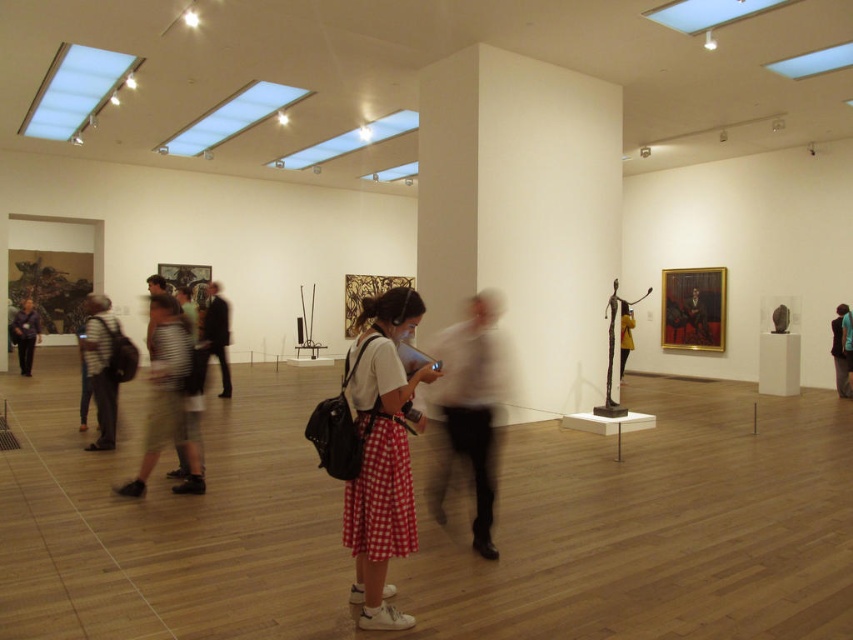
You are an art enthusiast standing in the gallery. You notice two items on the left side of the room, the striped shirt at left and the matte black backpack at left. Which item is positioned closer to you?

The striped shirt at left is closer to the viewer than the matte black backpack at left.

You are standing in the art gallery and notice two points marked in the image. The first point is at coordinates point (378,326) and the second is at point (840,387). Which of these points is nearer to your current position?

Point (378,326) is closer to the camera than point (840,387), so the first point is nearer to your current position.